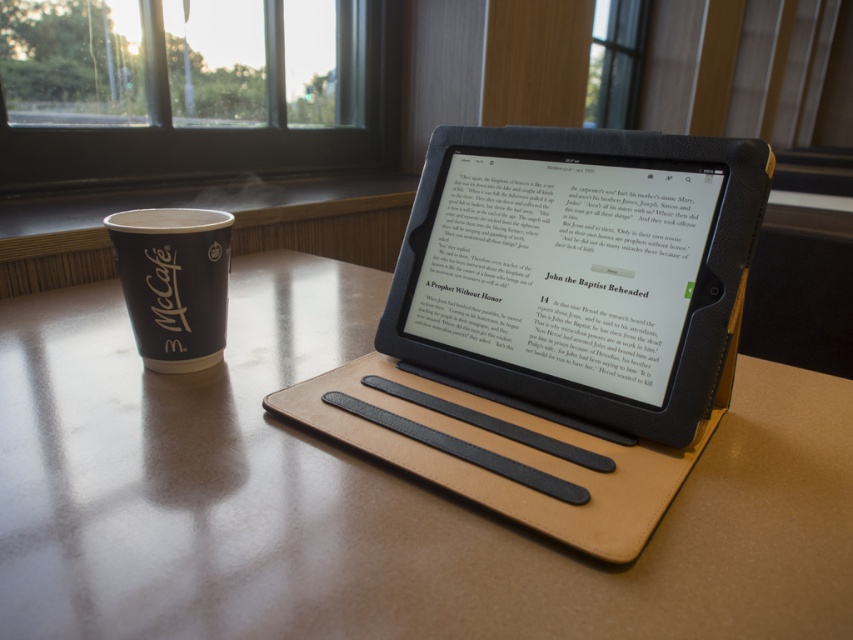
Who is more distant from viewer, (808, 596) or (180, 307)?

Point (180, 307)

Is brown leather table at center thinner than black paper cup at left?

No.

Identify the location of brown leather table at center. (367, 497).

Can you confirm if black leather tablet at center is positioned below black paper cup at left?

Indeed, black leather tablet at center is positioned under black paper cup at left.

Is black leather tablet at center smaller than black paper cup at left?

Actually, black leather tablet at center might be larger than black paper cup at left.

Where is `black leather tablet at center`? The height and width of the screenshot is (640, 853). black leather tablet at center is located at coordinates (556, 323).

The height and width of the screenshot is (640, 853). Identify the location of black leather tablet at center. (556, 323).

Identify the location of brown leather table at center. This screenshot has height=640, width=853. (367, 497).

Which of these two, brown leather table at center or black leather tablet at center, stands taller?

Standing taller between the two is black leather tablet at center.

The height and width of the screenshot is (640, 853). What are the coordinates of `brown leather table at center` in the screenshot? It's located at (367, 497).